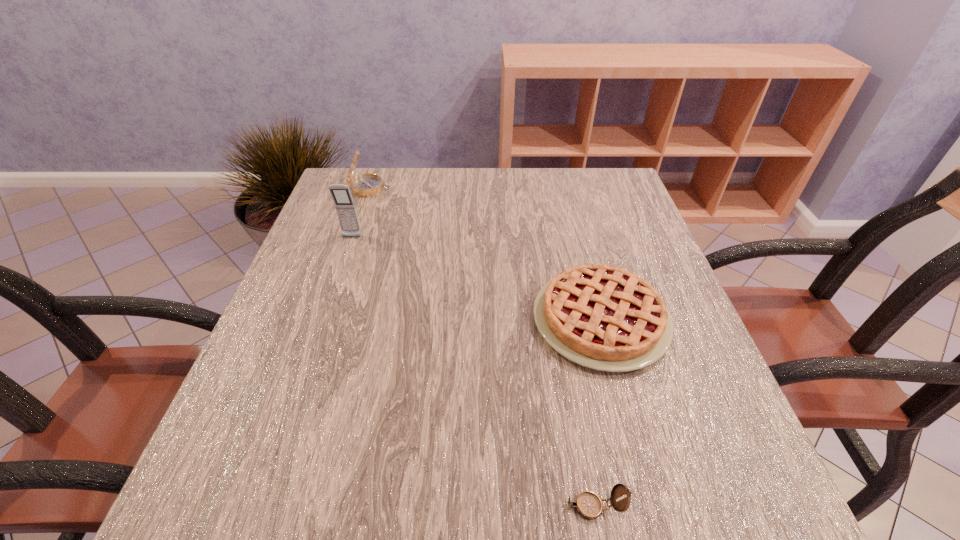
I want to click on vacant space located 0.250m on the face of the shorter compass, so [x=382, y=507].

Identify the location of free location located 0.210m on the face of the shorter compass. (411, 507).

The image size is (960, 540). What are the coordinates of `vacant space situated on the face of the shorter compass` in the screenshot? It's located at (389, 507).

Locate an element on the screen. object that is at the far edge is located at coordinates (364, 185).

Locate an element on the screen. The height and width of the screenshot is (540, 960). object that is at the near edge is located at coordinates (588, 504).

Locate an element on the screen. This screenshot has width=960, height=540. cellular telephone that is at the left edge is located at coordinates [344, 204].

At what (x,y) coordinates should I click in order to perform the action: click on compass that is at the left edge. Please return your answer as a coordinate pair (x, y). The height and width of the screenshot is (540, 960). Looking at the image, I should click on (364, 185).

You are a GUI agent. You are given a task and a screenshot of the screen. Output one action in this format:
    pyautogui.click(x=<x>, y=<y>)
    Task: Click on the object that is at the right edge
    
    Given the screenshot: What is the action you would take?
    pyautogui.click(x=602, y=317)

Find the location of a particular element. object positioned at the far left corner is located at coordinates (364, 185).

Where is `vacant space at the far edge of the desktop`? The width and height of the screenshot is (960, 540). vacant space at the far edge of the desktop is located at coordinates (410, 208).